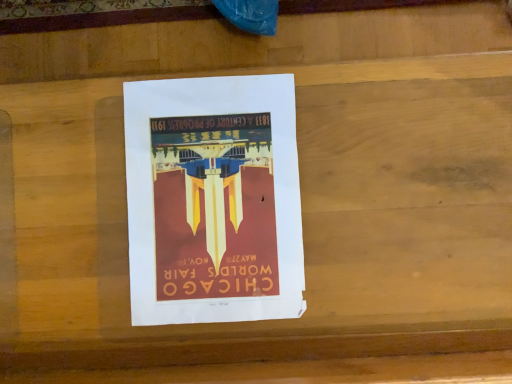
This screenshot has height=384, width=512. In order to click on matte paper poster at center in this screenshot , I will do `click(213, 200)`.

What do you see at coordinates (213, 200) in the screenshot? The image size is (512, 384). I see `matte paper poster at center` at bounding box center [213, 200].

The width and height of the screenshot is (512, 384). I want to click on matte paper poster at center, so [213, 200].